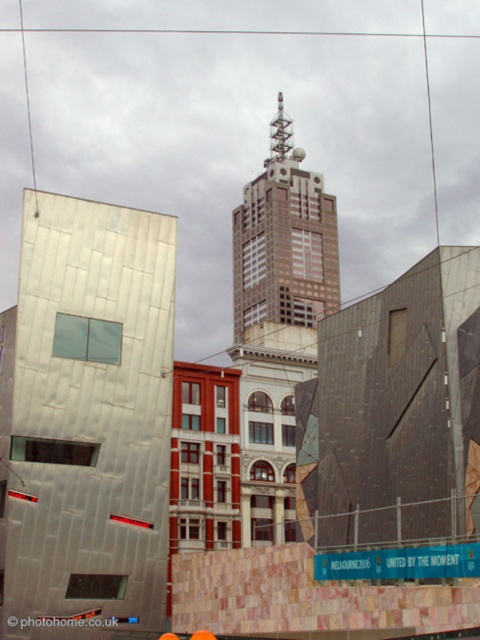
Question: Which of the following is the closest to the observer?

Choices:
 (A) metallic silver building at left
 (B) brown glassy building at center

Answer: (A)

Question: Is metallic silver building at left further to the viewer compared to brown glassy building at center?

Choices:
 (A) no
 (B) yes

Answer: (A)

Question: Does metallic silver building at left appear under brown glassy building at center?

Choices:
 (A) no
 (B) yes

Answer: (B)

Question: Does metallic silver building at left come in front of brown glassy building at center?

Choices:
 (A) yes
 (B) no

Answer: (A)